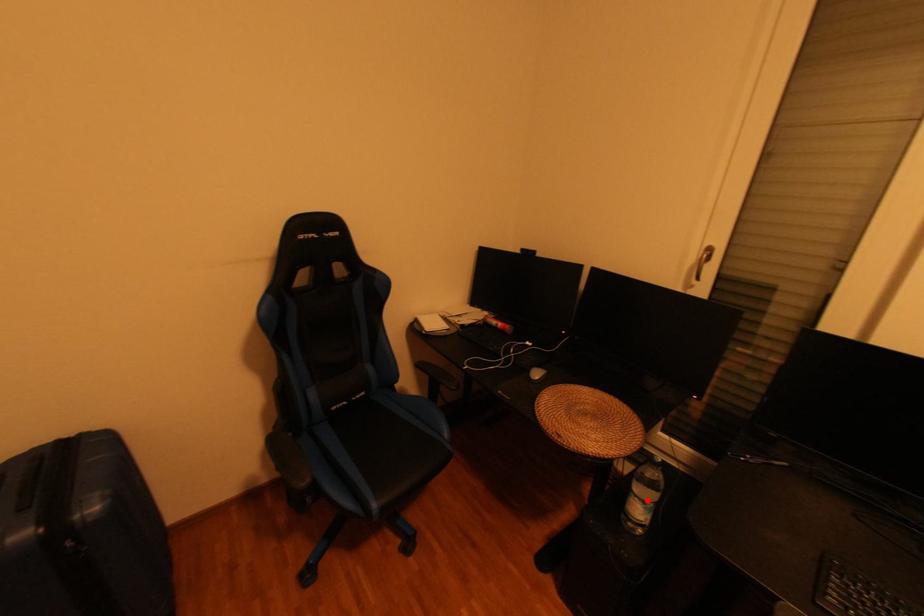
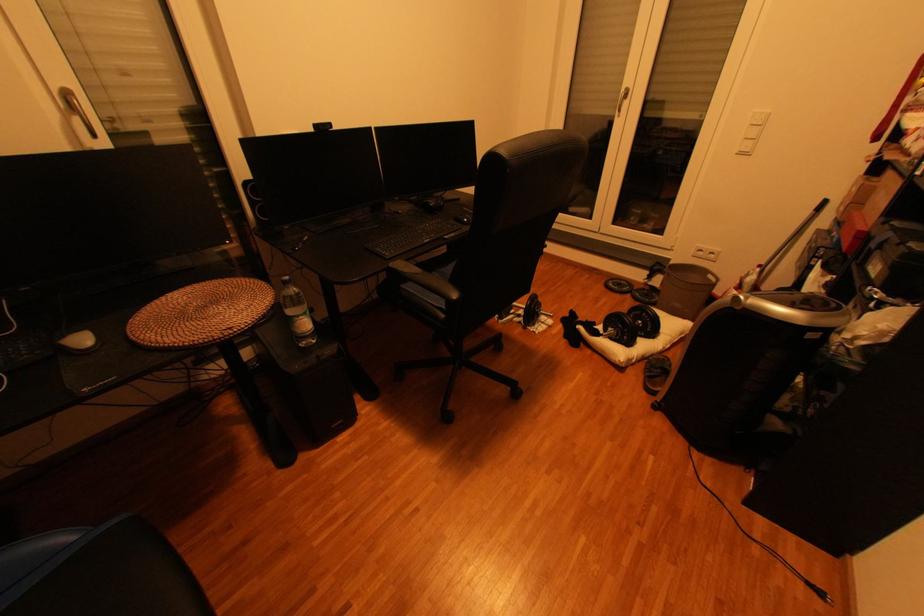
The point at the highlighted location is marked in the first image. Where is the corresponding point in the second image?

(310, 318)